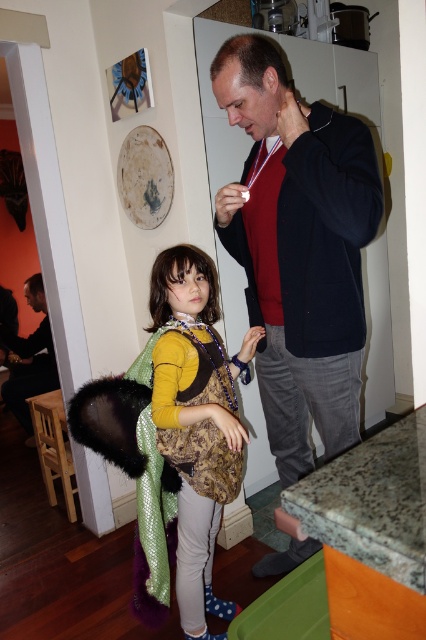
Question: Estimate the real-world distances between objects in this image. Which object is farther from the dark brown leather jacket at left?

Choices:
 (A) patterned fabric dress at center
 (B) light brown wooden stool at lower left
 (C) dark blue sweater at center

Answer: (C)

Question: Estimate the real-world distances between objects in this image. Which object is farther from the dark brown leather jacket at left?

Choices:
 (A) dark blue sweater at center
 (B) patterned fabric dress at center
 (C) light brown wooden stool at lower left

Answer: (A)

Question: Is dark blue sweater at center to the left of light brown wooden stool at lower left from the viewer's perspective?

Choices:
 (A) yes
 (B) no

Answer: (B)

Question: Can you confirm if patterned fabric dress at center is thinner than light brown wooden stool at lower left?

Choices:
 (A) yes
 (B) no

Answer: (B)

Question: Is the position of dark blue sweater at center more distant than that of dark brown leather jacket at left?

Choices:
 (A) no
 (B) yes

Answer: (A)

Question: Which object is the farthest from the dark blue sweater at center?

Choices:
 (A) light brown wooden stool at lower left
 (B) patterned fabric dress at center

Answer: (A)